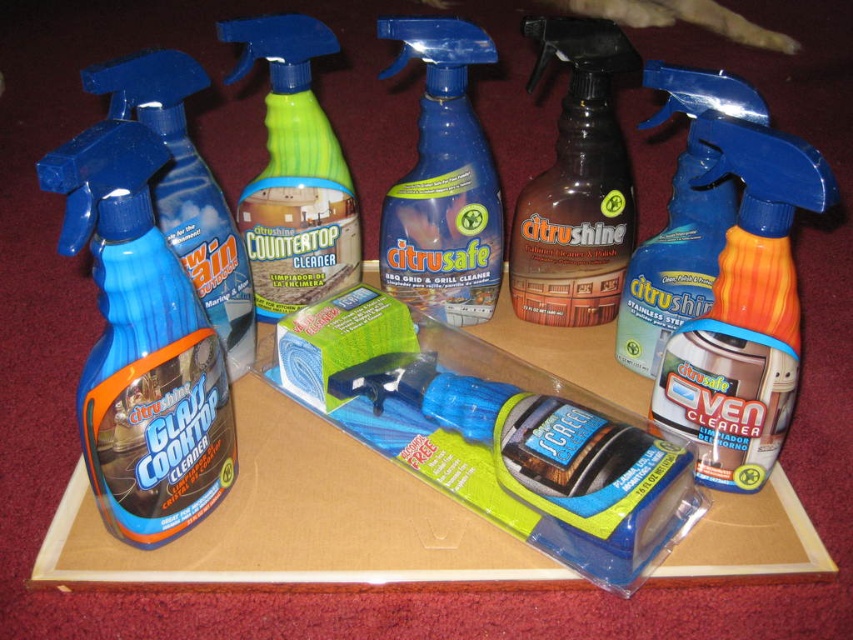
Question: Is blue plastic oven cleaner at center right smaller than blue plastic spray bottle at center?

Choices:
 (A) no
 (B) yes

Answer: (A)

Question: Among these points, which one is nearest to the camera?

Choices:
 (A) (744, 108)
 (B) (285, 81)
 (C) (415, 256)
 (D) (599, 186)

Answer: (A)

Question: Among these objects, which one is nearest to the camera?

Choices:
 (A) blue plastic oven cleaner at center right
 (B) matte plastic glass cleaner at left

Answer: (A)

Question: Observing the image, what is the correct spatial positioning of blue plastic oven cleaner at center right in reference to blue plastic spray bottle at center?

Choices:
 (A) above
 (B) below

Answer: (B)

Question: Which point appears closest to the camera in this image?

Choices:
 (A) (757, 134)
 (B) (258, 177)
 (C) (242, 284)
 (D) (300, 353)

Answer: (A)

Question: Can you confirm if blue plastic scrub brush at center is thinner than blue plastic oven cleaner at center right?

Choices:
 (A) yes
 (B) no

Answer: (B)